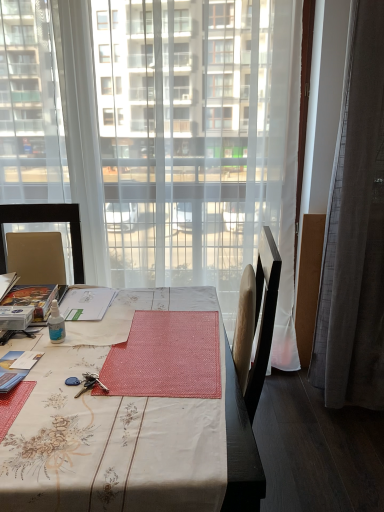
Question: Considering the relative sizes of transparent plastic bottle at table center and gray fabric curtain at right in the image provided, is transparent plastic bottle at table center wider than gray fabric curtain at right?

Choices:
 (A) yes
 (B) no

Answer: (B)

Question: Can gray fabric curtain at right be found inside transparent plastic bottle at table center?

Choices:
 (A) no
 (B) yes

Answer: (A)

Question: Can you confirm if transparent plastic bottle at table center is shorter than gray fabric curtain at right?

Choices:
 (A) no
 (B) yes

Answer: (B)

Question: Is transparent plastic bottle at table center next to gray fabric curtain at right and touching it?

Choices:
 (A) yes
 (B) no

Answer: (B)

Question: From the image's perspective, is transparent plastic bottle at table center below gray fabric curtain at right?

Choices:
 (A) no
 (B) yes

Answer: (B)

Question: Does transparent plastic bottle at table center appear on the right side of gray fabric curtain at right?

Choices:
 (A) yes
 (B) no

Answer: (B)

Question: Are transparent curtain at center and transparent plastic bottle at table center far apart?

Choices:
 (A) no
 (B) yes

Answer: (B)

Question: From a real-world perspective, does transparent curtain at center stand above transparent plastic bottle at table center?

Choices:
 (A) no
 (B) yes

Answer: (B)

Question: Would you say transparent curtain at center contains transparent plastic bottle at table center?

Choices:
 (A) yes
 (B) no

Answer: (B)

Question: Is transparent curtain at center taller than transparent plastic bottle at table center?

Choices:
 (A) yes
 (B) no

Answer: (A)

Question: From the image's perspective, is transparent curtain at center beneath transparent plastic bottle at table center?

Choices:
 (A) no
 (B) yes

Answer: (A)

Question: Is transparent curtain at center directly adjacent to transparent plastic bottle at table center?

Choices:
 (A) yes
 (B) no

Answer: (B)

Question: Is the position of floral-patterned fabric desk at center less distant than that of gray fabric curtain at right?

Choices:
 (A) no
 (B) yes

Answer: (B)